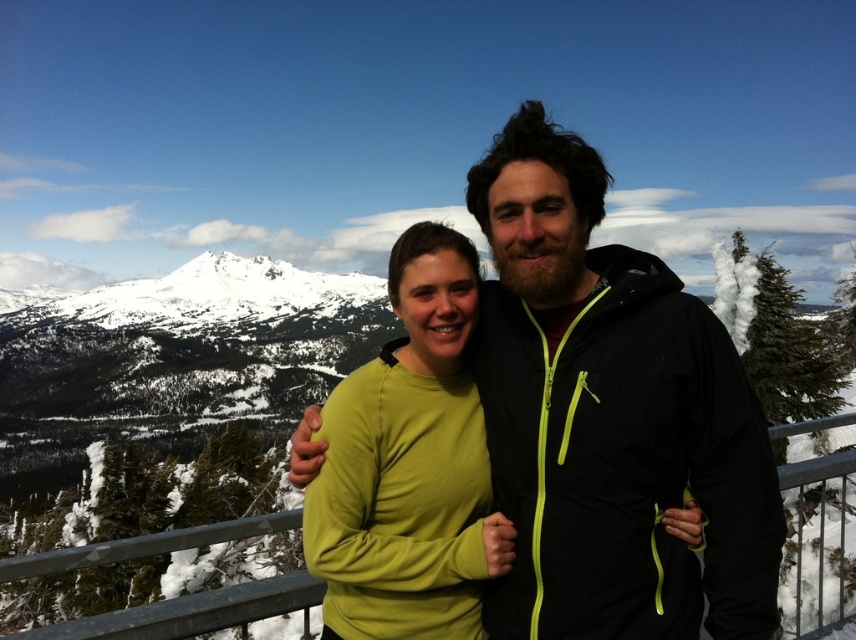
In the scene shown: Does matte black jacket at center appear under green matte sweater at center?

Actually, matte black jacket at center is above green matte sweater at center.

Is matte black jacket at center positioned before green matte sweater at center?

That is True.

The image size is (856, 640). Identify the location of matte black jacket at center. (610, 417).

Locate an element on the screen. The height and width of the screenshot is (640, 856). matte black jacket at center is located at coordinates (610, 417).